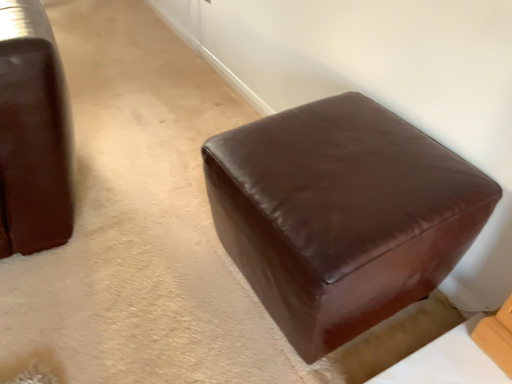
Describe the element at coordinates (341, 215) in the screenshot. I see `brown leather ottoman at center` at that location.

Image resolution: width=512 pixels, height=384 pixels. What are the coordinates of `brown leather ottoman at center` in the screenshot? It's located at (341, 215).

In order to face brown leather ottoman at center, should I rotate leftwards or rightwards?

Turn right approximately 9.060 degrees to face it.

What is the approximate height of brown leather ottoman at center?

brown leather ottoman at center is 17.57 inches tall.

Find the location of a particular element. The height and width of the screenshot is (384, 512). brown leather ottoman at center is located at coordinates (341, 215).